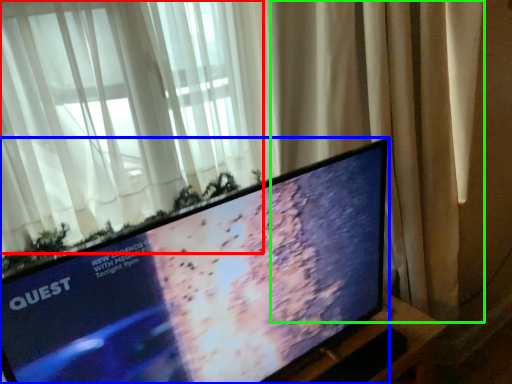
Question: Considering the real-world distances, which object is closest to curtain (highlighted by a red box)? television (highlighted by a blue box) or curtain (highlighted by a green box).

Choices:
 (A) television
 (B) curtain

Answer: (B)